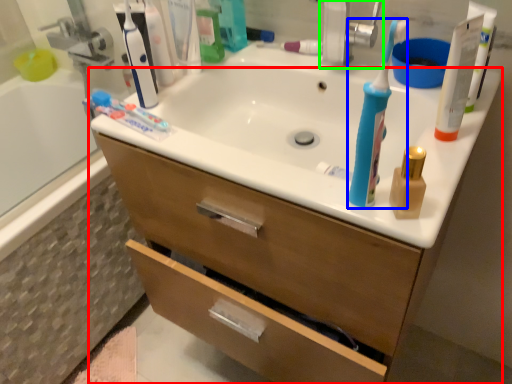
Question: Based on their relative distances, which object is nearer to bathroom cabinet (highlighted by a red box)? Choose from toothbrush (highlighted by a blue box) and faucet (highlighted by a green box).

Choices:
 (A) toothbrush
 (B) faucet

Answer: (A)